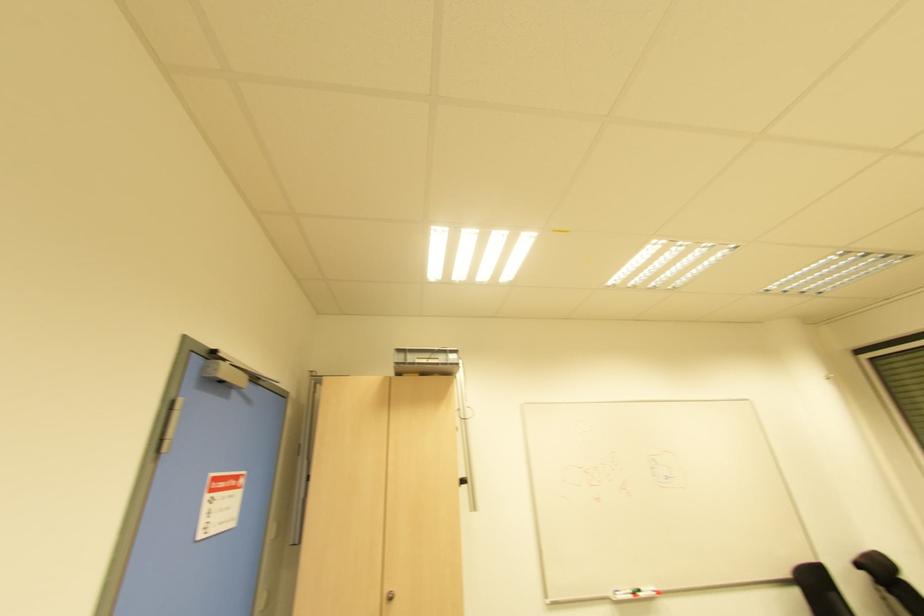
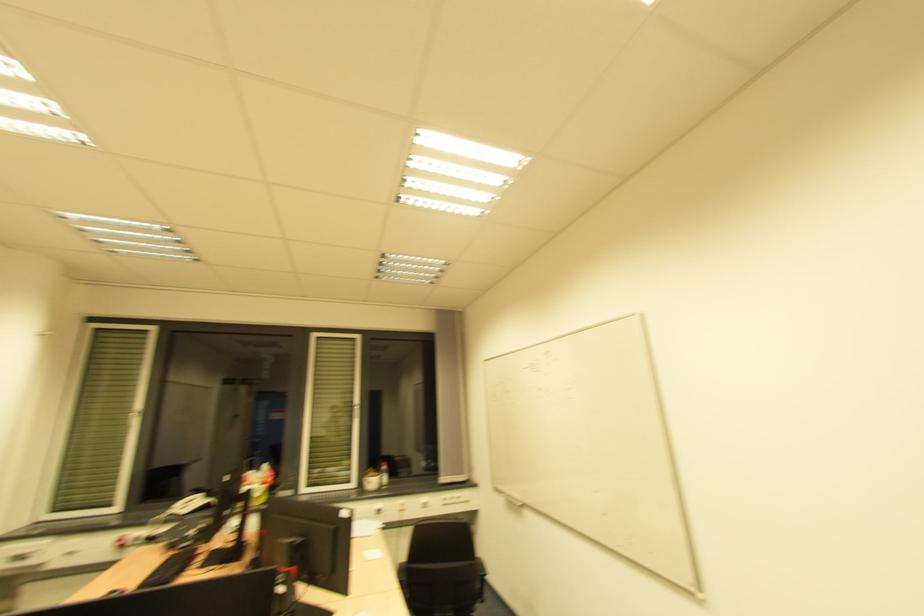
First-person continuous shooting, in which direction is the camera rotating?

The camera rotated toward right-up.